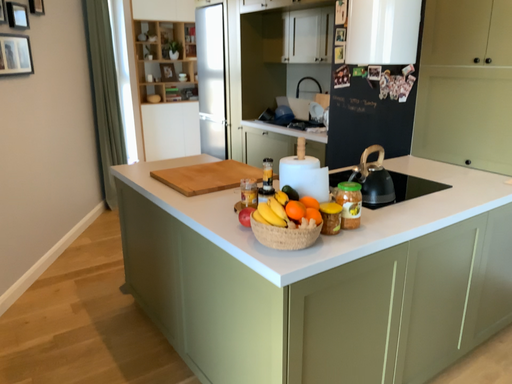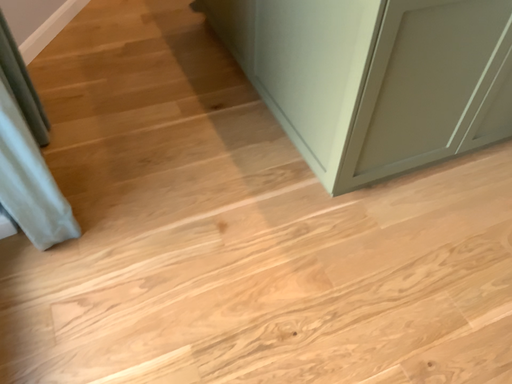
Question: How did the camera likely rotate when shooting the video?

Choices:
 (A) rotated downward
 (B) rotated upward

Answer: (A)